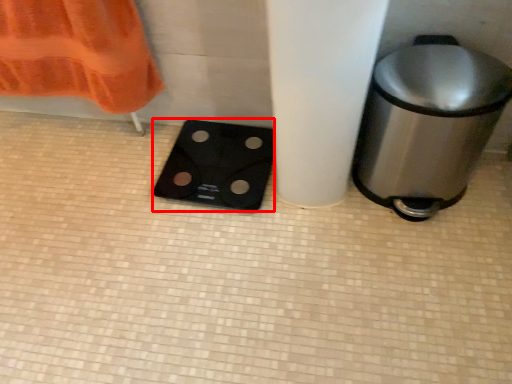
Question: From the image's perspective, where is appliance (annotated by the red box) located in relation to waste container in the image?

Choices:
 (A) above
 (B) below

Answer: (B)